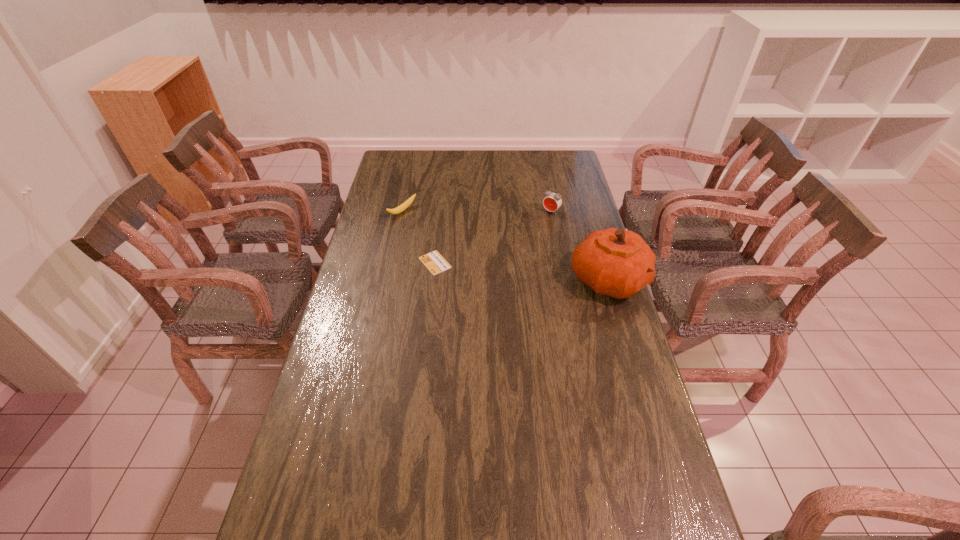
At what (x,y) coordinates should I click in order to perform the action: click on vacant space located 0.350m on the upward curve of the third tallest object. Please return your answer as a coordinate pair (x, y). This screenshot has height=540, width=960. Looking at the image, I should click on (475, 254).

This screenshot has height=540, width=960. Find the location of `free space located on the upward curve of the third tallest object`. free space located on the upward curve of the third tallest object is located at coordinates (430, 228).

Where is `vacant area located on the upward curve of the third tallest object`? This screenshot has width=960, height=540. vacant area located on the upward curve of the third tallest object is located at coordinates (454, 241).

Locate an element on the screen. object that is at the left edge is located at coordinates (407, 203).

At what (x,y) coordinates should I click in order to perform the action: click on pumpkin that is at the right edge. Please return your answer as a coordinate pair (x, y). The width and height of the screenshot is (960, 540). Looking at the image, I should click on (615, 262).

Where is `alarm clock located in the right edge section of the desktop`? alarm clock located in the right edge section of the desktop is located at coordinates (552, 201).

This screenshot has width=960, height=540. I want to click on vacant space at the far edge of the desktop, so click(464, 168).

Identify the location of free space at the near edge of the desktop. (405, 522).

Find the location of `free space at the left edge`. free space at the left edge is located at coordinates (372, 348).

This screenshot has height=540, width=960. In the image, there is a desktop. Find the location of `vacant region at the right edge`. vacant region at the right edge is located at coordinates (605, 311).